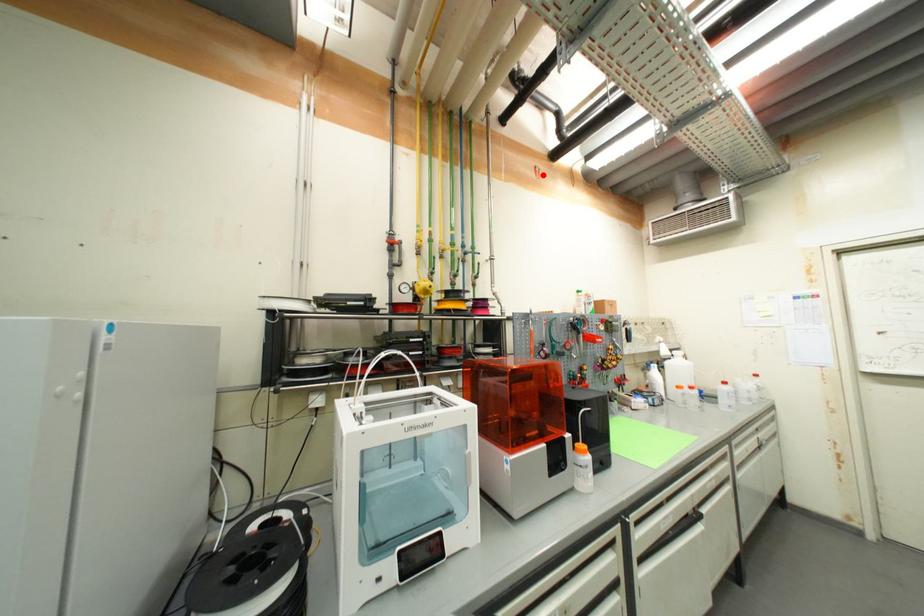
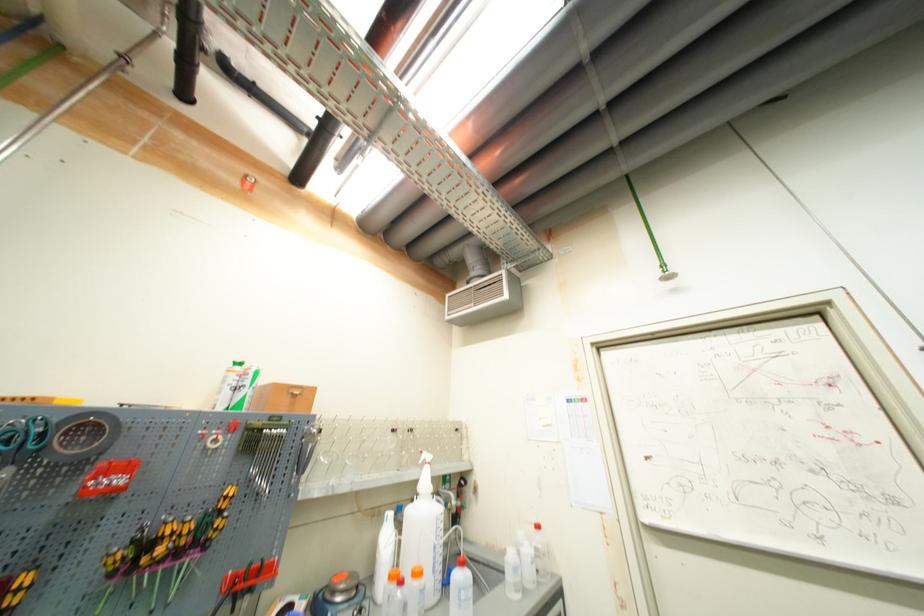
Locate, in the second image, the point that corresponds to the highlighted location in the first image.

(253, 185)